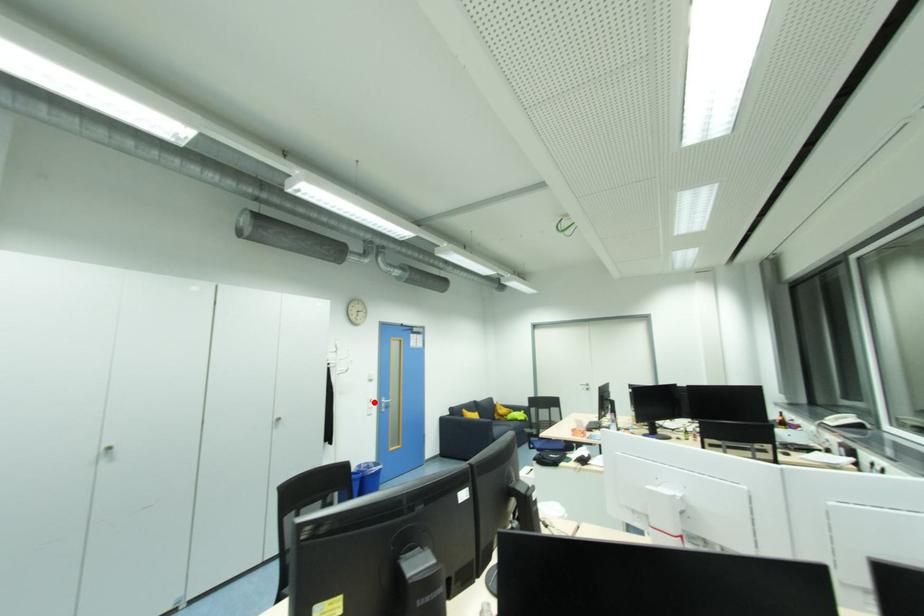
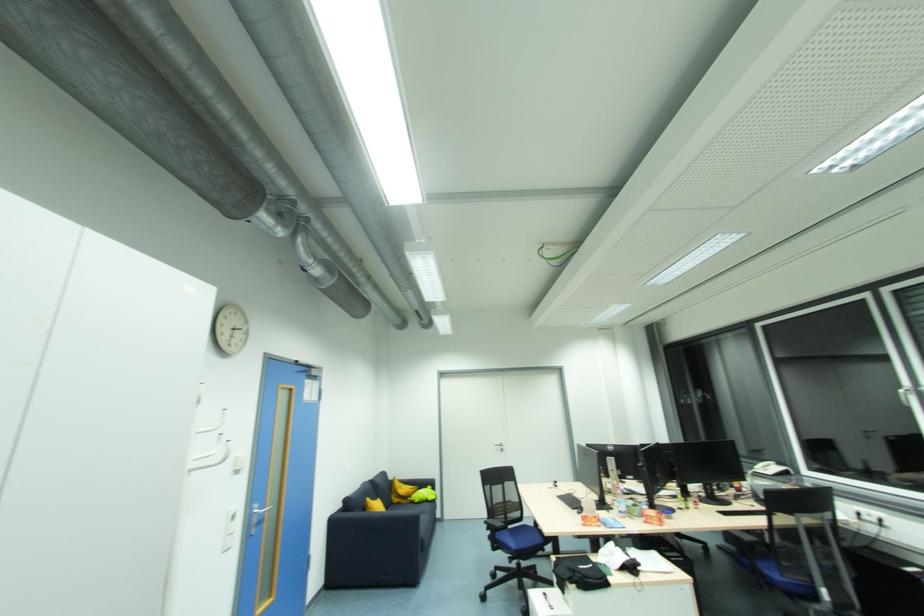
In the second image, find the point that corresponds to the highlighted location in the first image.

(236, 520)